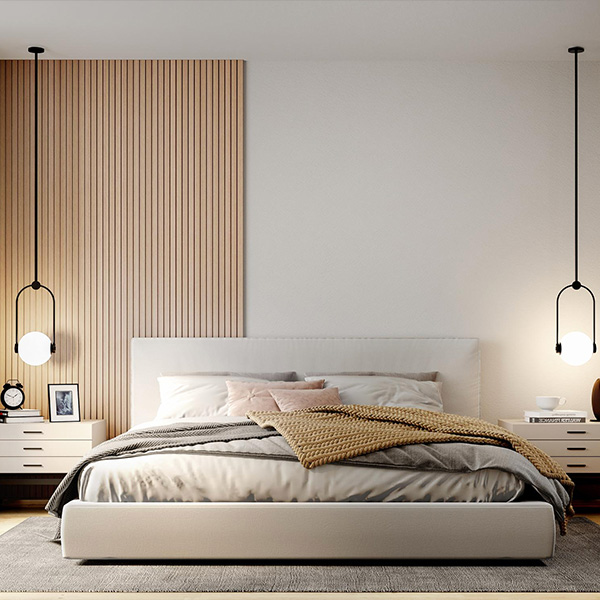
You are a GUI agent. You are given a task and a screenshot of the screen. Output one action in this format:
    pyautogui.click(x=<x>, y=<y>)
    Task: Click on the pillow
    
    Given the screenshot: What is the action you would take?
    pyautogui.click(x=212, y=399), pyautogui.click(x=283, y=372), pyautogui.click(x=428, y=372), pyautogui.click(x=414, y=390), pyautogui.click(x=316, y=397), pyautogui.click(x=252, y=404), pyautogui.click(x=308, y=384)